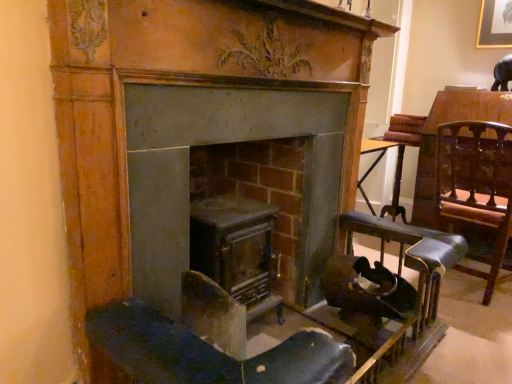
Question: Considering the relative sizes of matte gray fireplace at center, the 1th fireplace when ordered from right to left, and metallic gray stove at center, which ranks as the first fireplace in left-to-right order, in the image provided, is matte gray fireplace at center, the 1th fireplace when ordered from right to left, wider than metallic gray stove at center, which ranks as the first fireplace in left-to-right order,?

Choices:
 (A) no
 (B) yes

Answer: (A)

Question: From a real-world perspective, does matte gray fireplace at center, which is the 2th fireplace in left-to-right order, stand above metallic gray stove at center, marked as the 2th fireplace in a right-to-left arrangement?

Choices:
 (A) yes
 (B) no

Answer: (A)

Question: Are matte gray fireplace at center, which is the 2th fireplace in left-to-right order, and metallic gray stove at center, which ranks as the first fireplace in left-to-right order, making contact?

Choices:
 (A) no
 (B) yes

Answer: (A)

Question: Is matte gray fireplace at center, the 1th fireplace when ordered from right to left, behind metallic gray stove at center, which ranks as the first fireplace in left-to-right order?

Choices:
 (A) no
 (B) yes

Answer: (A)

Question: Can you confirm if matte gray fireplace at center, the 1th fireplace when ordered from right to left, is smaller than metallic gray stove at center, marked as the 2th fireplace in a right-to-left arrangement?

Choices:
 (A) yes
 (B) no

Answer: (A)

Question: Is metallic gray stove at center, which ranks as the first fireplace in left-to-right order, taller or shorter than leather seat at right?

Choices:
 (A) tall
 (B) short

Answer: (B)

Question: Is metallic gray stove at center, which ranks as the first fireplace in left-to-right order, spatially inside leather seat at right, or outside of it?

Choices:
 (A) inside
 (B) outside

Answer: (B)

Question: Considering their positions, is metallic gray stove at center, marked as the 2th fireplace in a right-to-left arrangement, located in front of or behind leather seat at right?

Choices:
 (A) behind
 (B) front

Answer: (B)

Question: Is point (160, 220) closer or farther from the camera than point (496, 276)?

Choices:
 (A) closer
 (B) farther

Answer: (A)

Question: Is matte gray fireplace at center, which is the 2th fireplace in left-to-right order, inside the boundaries of leather seat at right, or outside?

Choices:
 (A) inside
 (B) outside

Answer: (B)

Question: Does point (92, 94) appear closer or farther from the camera than point (458, 208)?

Choices:
 (A) closer
 (B) farther

Answer: (A)

Question: Looking at the image, does matte gray fireplace at center, the 1th fireplace when ordered from right to left, seem bigger or smaller compared to leather seat at right?

Choices:
 (A) big
 (B) small

Answer: (B)

Question: In the image, is matte gray fireplace at center, the 1th fireplace when ordered from right to left, positioned in front of or behind leather seat at right?

Choices:
 (A) behind
 (B) front

Answer: (B)

Question: Is metallic gray stove at center, marked as the 2th fireplace in a right-to-left arrangement, inside or outside of matte gray fireplace at center, the 1th fireplace when ordered from right to left?

Choices:
 (A) inside
 (B) outside

Answer: (B)

Question: Based on their sizes in the image, would you say metallic gray stove at center, marked as the 2th fireplace in a right-to-left arrangement, is bigger or smaller than matte gray fireplace at center, which is the 2th fireplace in left-to-right order?

Choices:
 (A) big
 (B) small

Answer: (A)